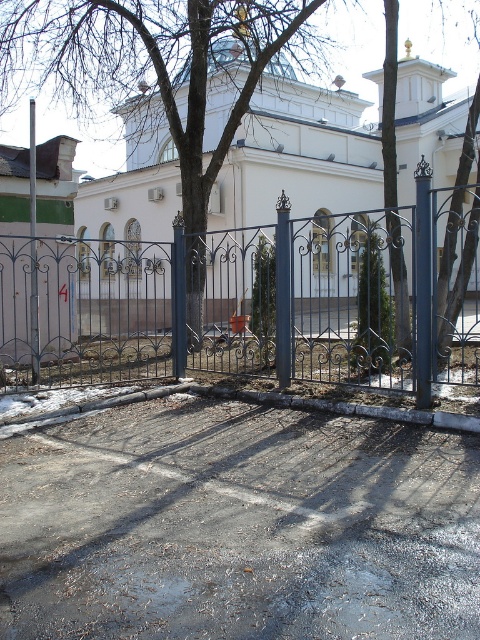
Question: Does metallic wrought iron fence at center have a smaller size compared to white matte fence at center?

Choices:
 (A) yes
 (B) no

Answer: (A)

Question: Is metallic wrought iron fence at center closer to camera compared to white matte fence at center?

Choices:
 (A) no
 (B) yes

Answer: (B)

Question: Does metallic wrought iron fence at center have a smaller size compared to white matte fence at center?

Choices:
 (A) no
 (B) yes

Answer: (B)

Question: Which point appears closest to the camera in this image?

Choices:
 (A) (422, 106)
 (B) (115, 371)

Answer: (B)

Question: Among these objects, which one is nearest to the camera?

Choices:
 (A) white matte fence at center
 (B) metallic wrought iron fence at center

Answer: (B)